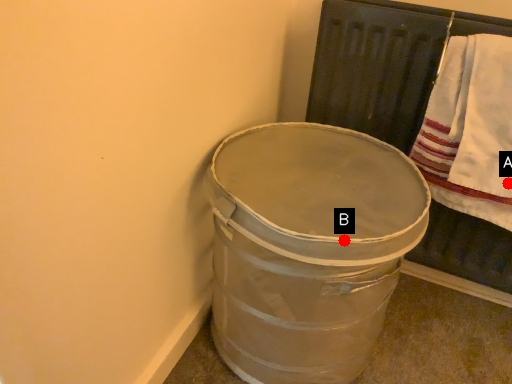
Question: Two points are circled on the image, labeled by A and B beside each circle. Which point is further to the camera?

Choices:
 (A) A is further
 (B) B is further

Answer: (A)